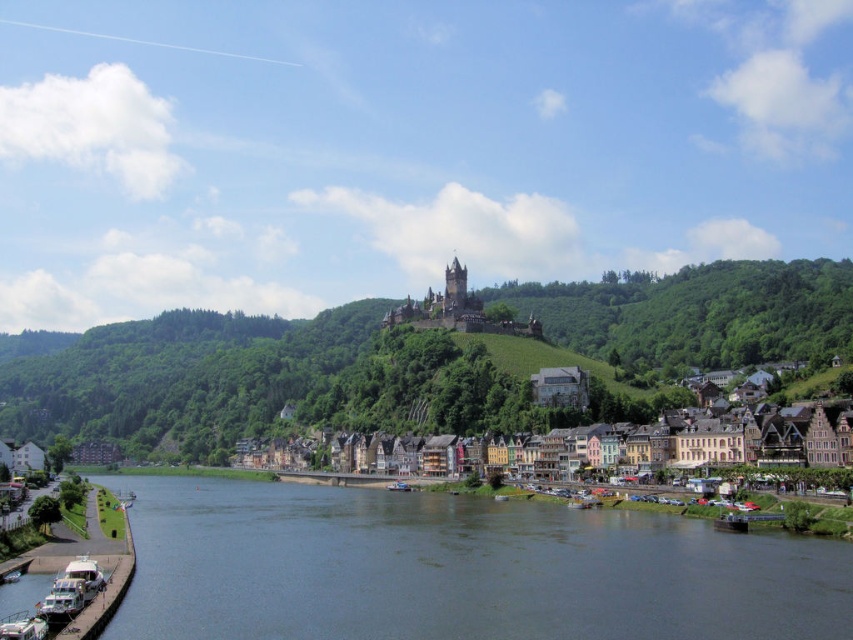
You are standing on the riverbank and want to take a photo of the white glossy boat at lower left and the multicolored stone buildings at center. Which object should you focus on first if you want both to be in clear focus?

The white glossy boat at lower left is behind the multicolored stone buildings at center, so you should focus on the multicolored stone buildings at center first to ensure both are in clear focus.

You are standing at the riverbank and want to take a photo of the green leafy hillside at center. Based on its 2D coordinates, in which general direction should you point your camera to capture it?

The green leafy hillside at center is located at coordinates approximately 0.562 on the x axis and 0.487 on the y axis. Since the x coordinate is closer to 0.5, it is centrally positioned horizontally. The y coordinate of 0.487 places it slightly above the center vertically. Therefore, to capture the green leafy hillside at center, you should aim your camera towards the central area of the scene, slightly upwards from the horizon.

You are standing at the riverside in the town and want to take a photo of a specific point located at coordinates point (838,449). Your camera has a maximum focus range of 300 feet. Will you be able to focus on that point?

The distance of point (838,449) from camera is 295.15 feet, which is within the camera maximum focus range of 300 feet, so yes, you can focus on that point.